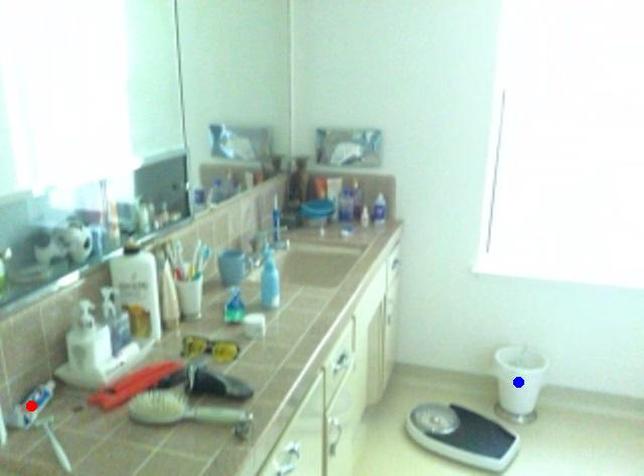
Question: In the image, two points are highlighted. Which point is nearer to the camera? Reply with the corresponding letter.

Choices:
 (A) blue point
 (B) red point

Answer: (B)